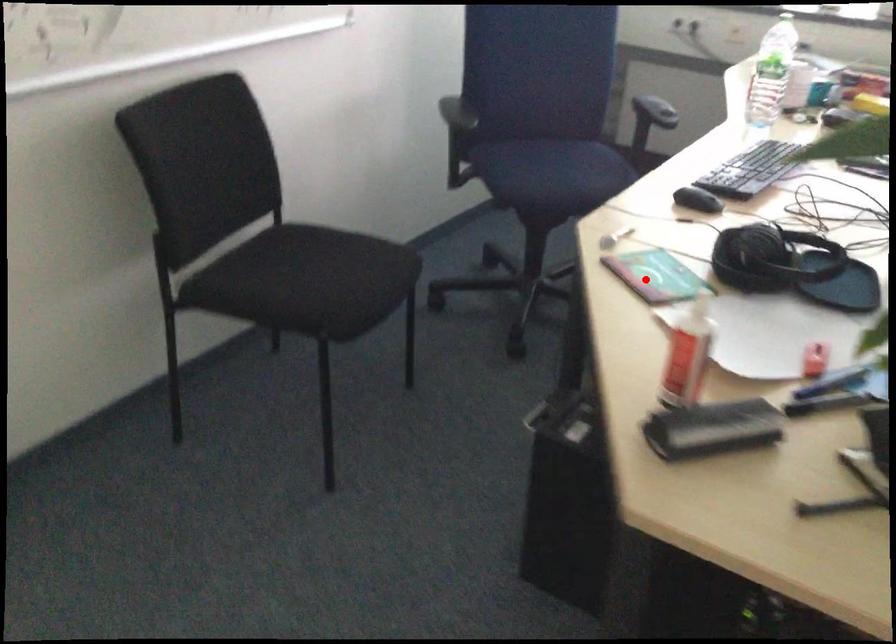
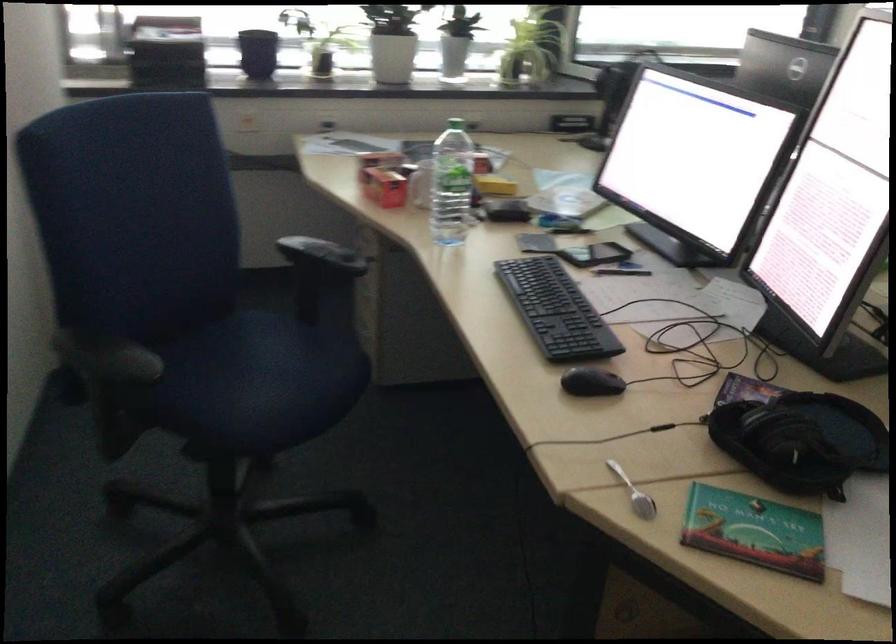
Question: I am providing you with two images of the same scene from different viewpoints. A red point is shown in image1. For the corresponding object point in image2, is it positioned nearer or farther from the camera?

Choices:
 (A) Nearer
 (B) Farther

Answer: (A)